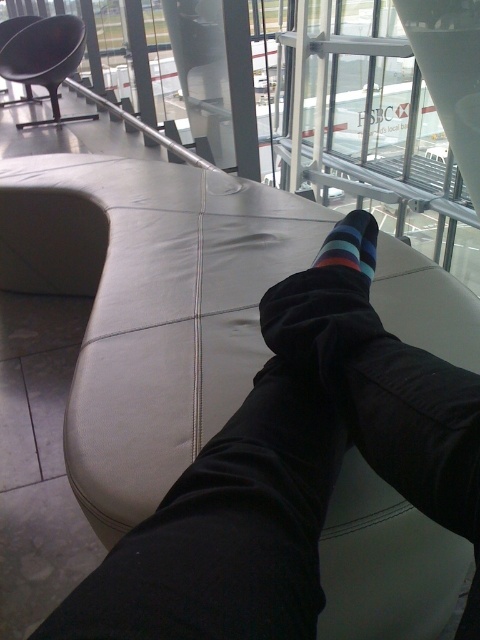
You are sitting on the bench and want to put your bag on the floor between the matte black pants at center and the matte black chair at upper left. Is there enough space for the bag?

The matte black pants at center is in front of the matte black chair at upper left, so there is space between them for the bag.

You are sitting on the curved leather bench in the airport terminal. You want to move your striped cotton sock at center to the matte black chair at upper left. Is the chair to the left or right of the sock?

The matte black chair at upper left is to the left of the striped cotton sock at center.

You are sitting on the curved leather bench in the airport terminal. You notice two points marked on the floor in front of you. The first point is at coordinates point (55, 84) and the second is at point (360, 236). If you want to reach the point that is closer to you, which coordinate should you move towards?

You should move towards point (55, 84) because it is behind point (360, 236), meaning it is closer to your current position on the bench.